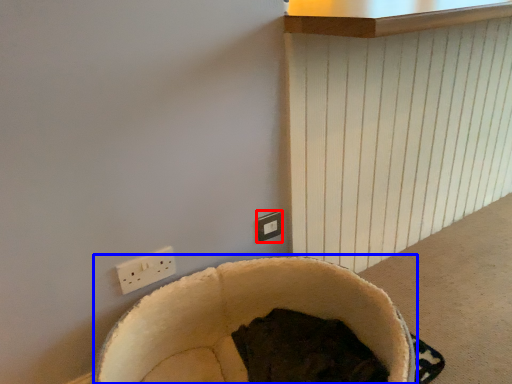
Question: Which object is closer to the camera taking this photo, electric outlet (highlighted by a red box) or bean bag chair (highlighted by a blue box)?

Choices:
 (A) electric outlet
 (B) bean bag chair

Answer: (B)